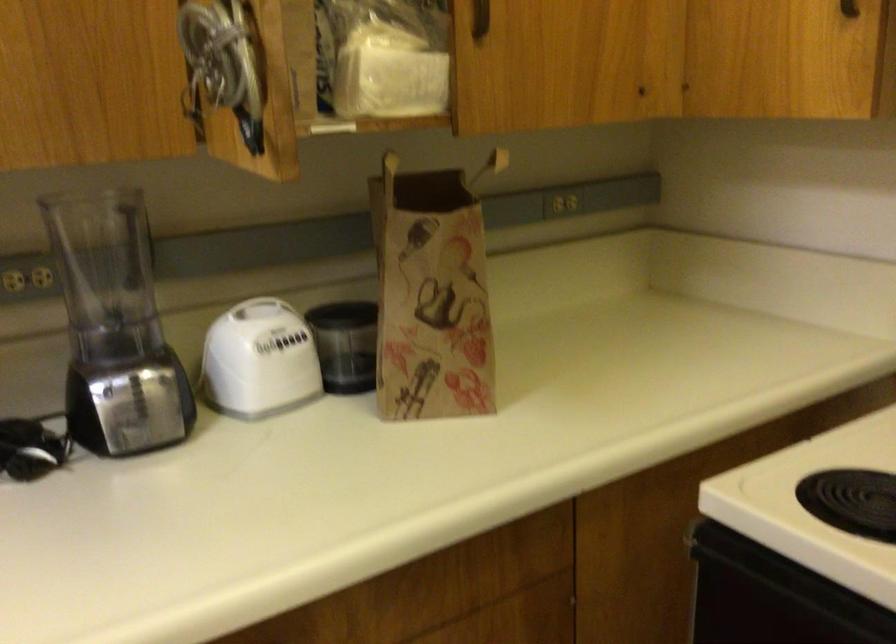
Find where to lift the dark grinder cup. Please return your answer as a coordinate pair (x, y).

(346, 345)